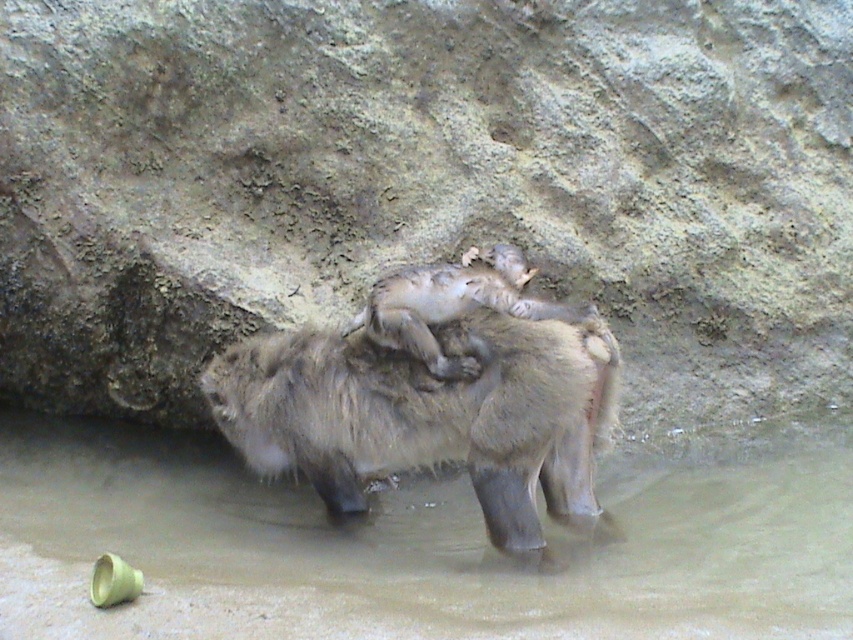
Question: Is brown rough rock at center smaller than fuzzy fur monkey at center?

Choices:
 (A) no
 (B) yes

Answer: (A)

Question: Is brown rough rock at center bigger than fuzzy fur monkey at center?

Choices:
 (A) yes
 (B) no

Answer: (A)

Question: Among these objects, which one is nearest to the camera?

Choices:
 (A) fuzzy fur monkey at center
 (B) muddy water at lower center
 (C) brown rough rock at center

Answer: (B)

Question: Which point is farther to the camera?

Choices:
 (A) (589, 74)
 (B) (721, 502)

Answer: (A)

Question: Estimate the real-world distances between objects in this image. Which object is farther from the muddy water at lower center?

Choices:
 (A) brown rough rock at center
 (B) fuzzy fur monkey at center

Answer: (A)

Question: Can you confirm if muddy water at lower center is positioned to the right of fuzzy fur monkey at center?

Choices:
 (A) yes
 (B) no

Answer: (A)